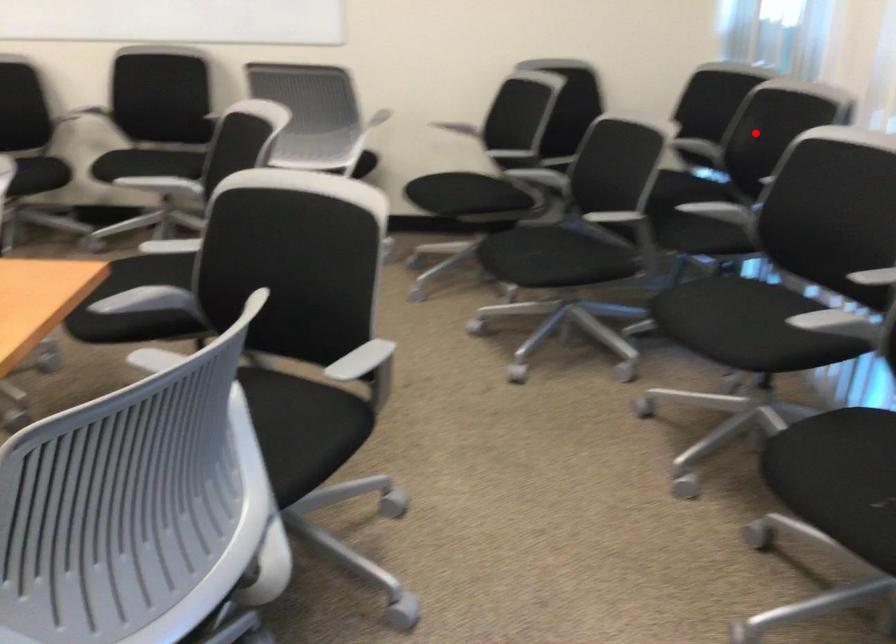
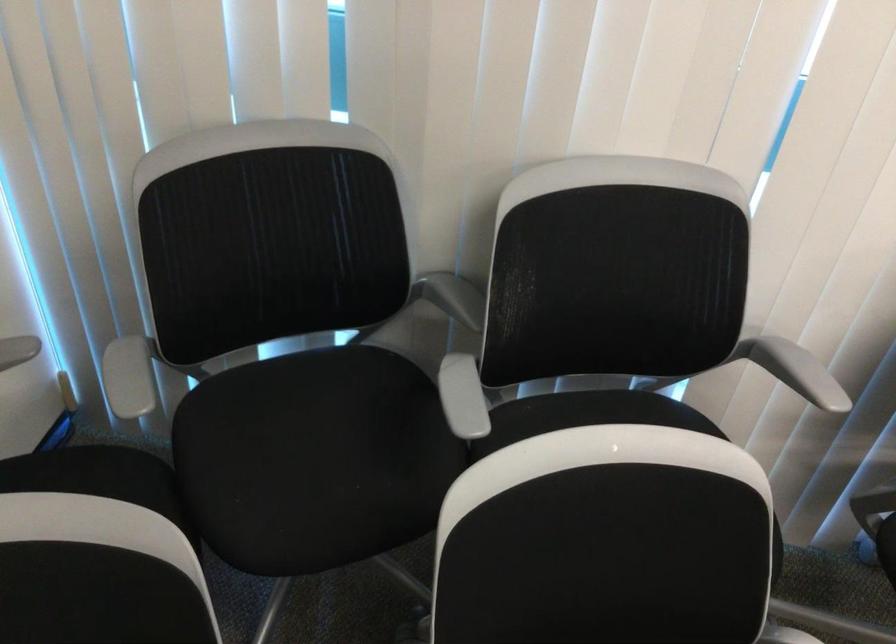
Find the pixel in the second image that matches the highlighted location in the first image.

(453, 297)